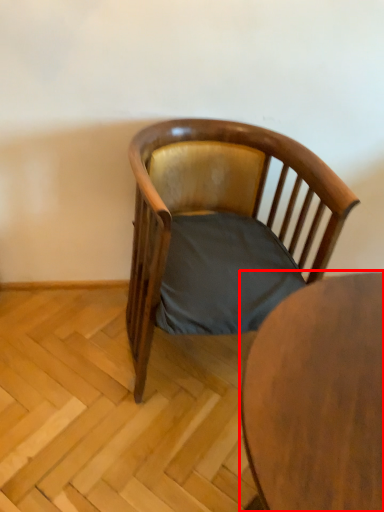
Question: From the image's perspective, where is table (annotated by the red box) located in relation to chair in the image?

Choices:
 (A) below
 (B) above

Answer: (A)